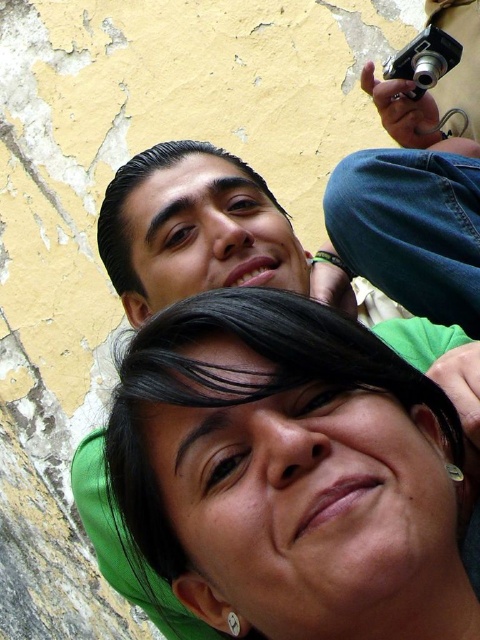
Question: Can you confirm if green matte hair at center is positioned to the left of black plastic camera at upper right?

Choices:
 (A) no
 (B) yes

Answer: (B)

Question: Is green matte hair at center in front of black plastic camera at upper right?

Choices:
 (A) no
 (B) yes

Answer: (B)

Question: Which of the following is the farthest from the observer?

Choices:
 (A) green matte hair at center
 (B) black plastic camera at upper right

Answer: (B)

Question: In this image, where is green matte hair at center located relative to black plastic camera at upper right?

Choices:
 (A) left
 (B) right

Answer: (A)